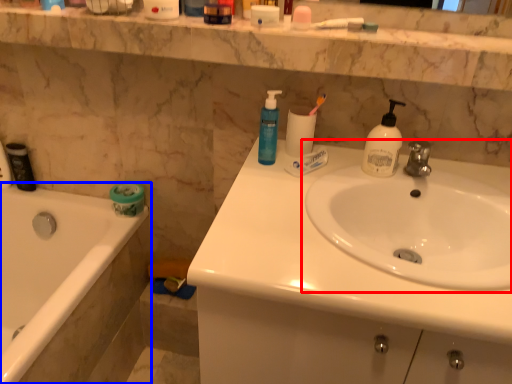
Question: Which point is further to the camera, sink (highlighted by a red box) or bathtub (highlighted by a blue box)?

Choices:
 (A) sink
 (B) bathtub

Answer: (B)